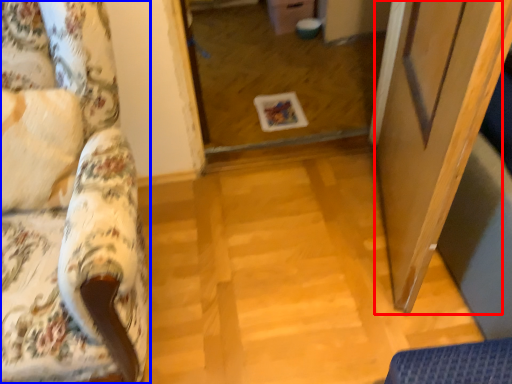
Question: Among these objects, which one is nearest to the camera, screen door (highlighted by a red box) or furniture (highlighted by a blue box)?

Choices:
 (A) screen door
 (B) furniture

Answer: (B)